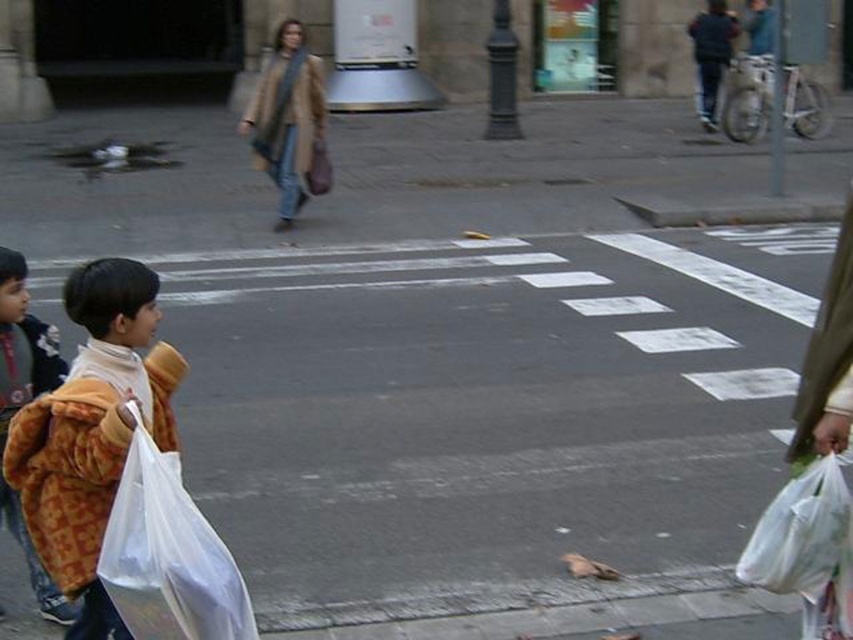
Between fluffy brown coat at lower left and yellow fur coat at left, which one appears on the left side from the viewer's perspective?

yellow fur coat at left

Identify the location of fluffy brown coat at lower left. The width and height of the screenshot is (853, 640). (91, 429).

Between point (90, 358) and point (140, 620), which one is positioned in front?

Positioned in front is point (140, 620).

Which is more to the right, fluffy brown coat at lower left or white plastic bag at lower left?

white plastic bag at lower left

Find the location of a particular element. fluffy brown coat at lower left is located at coordinates (91, 429).

Which is more to the left, white plastic bag at lower left or beige wool coat at center?

From the viewer's perspective, beige wool coat at center appears more on the left side.

Image resolution: width=853 pixels, height=640 pixels. In order to click on white plastic bag at lower left in this screenshot , I will do click(x=167, y=554).

Between point (167, 531) and point (296, 202), which one is positioned in front?

Point (167, 531) is more forward.

Where is `white plastic bag at lower left`? Image resolution: width=853 pixels, height=640 pixels. white plastic bag at lower left is located at coordinates (167, 554).